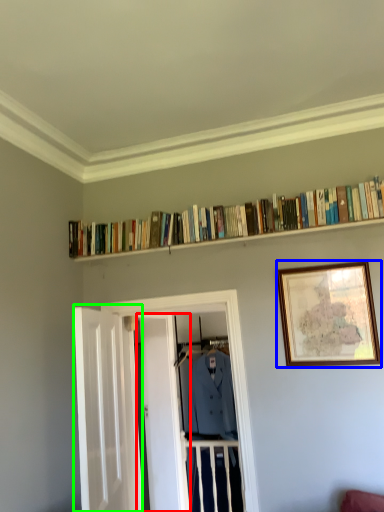
Question: Which object is positioned farthest from door (highlighted by a red box)? Select from picture frame (highlighted by a blue box) and door (highlighted by a green box).

Choices:
 (A) picture frame
 (B) door

Answer: (A)